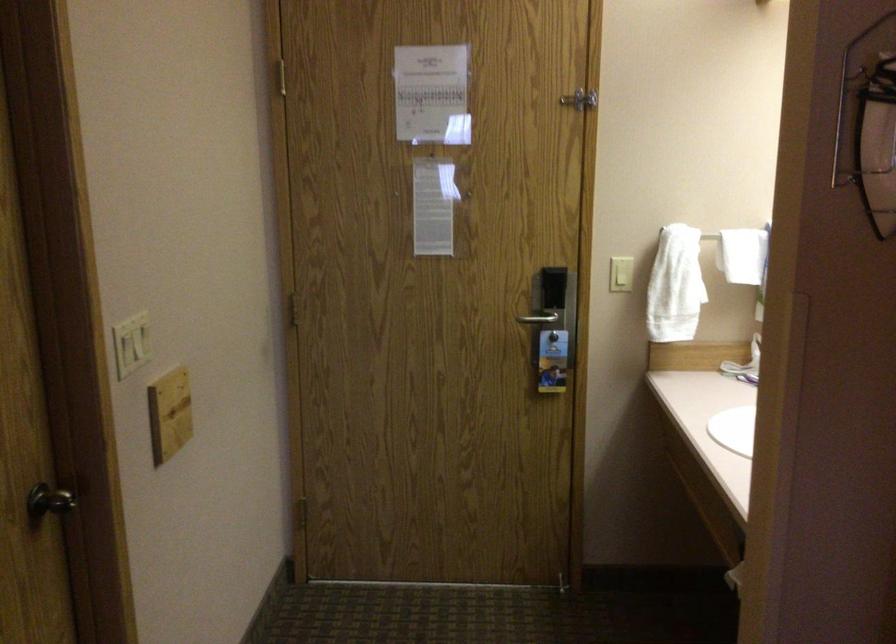
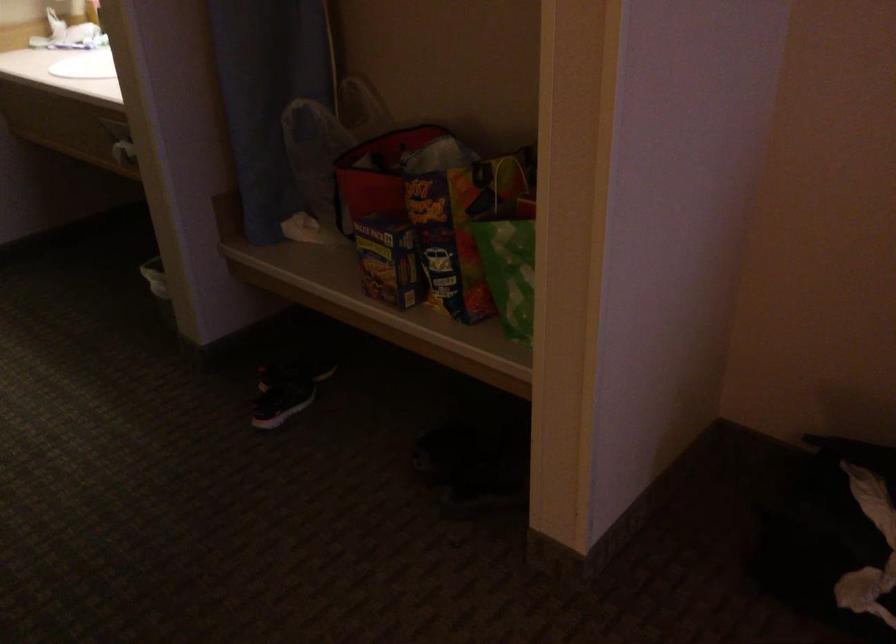
First-person continuous shooting, in which direction is the camera rotating?

The rotation direction of the camera is right-down.